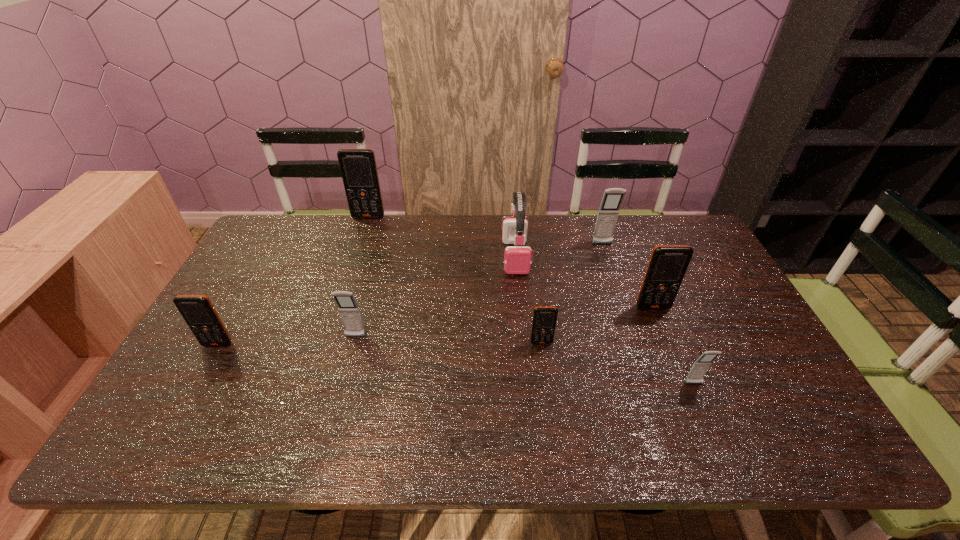
The image size is (960, 540). What are the coordinates of `vacant area situated 0.220m on the screen of the leftmost object` in the screenshot? It's located at (174, 423).

Locate an element on the screen. The image size is (960, 540). free space located on the screen of the third orange cellular telephone from left to right is located at coordinates (555, 445).

Image resolution: width=960 pixels, height=540 pixels. Identify the location of vacant space located 0.060m on the front-facing side of the nearest object. (705, 408).

You are a GUI agent. You are given a task and a screenshot of the screen. Output one action in this format:
    pyautogui.click(x=<x>, y=<y>)
    Task: Click on the earphone at the far edge
    The width and height of the screenshot is (960, 540).
    Given the screenshot: What is the action you would take?
    pyautogui.click(x=517, y=260)

This screenshot has width=960, height=540. Find the location of `object that is at the left edge`. object that is at the left edge is located at coordinates [x=197, y=310].

Where is `vacant space at the far edge of the desktop`? This screenshot has width=960, height=540. vacant space at the far edge of the desktop is located at coordinates (384, 219).

Where is `vacant area at the near edge`? vacant area at the near edge is located at coordinates (637, 437).

Where is `blank area at the left edge`? The width and height of the screenshot is (960, 540). blank area at the left edge is located at coordinates (180, 384).

This screenshot has height=540, width=960. I want to click on free spot at the right edge of the desktop, so [x=702, y=270].

Image resolution: width=960 pixels, height=540 pixels. I want to click on free space at the near left corner of the desktop, so click(200, 422).